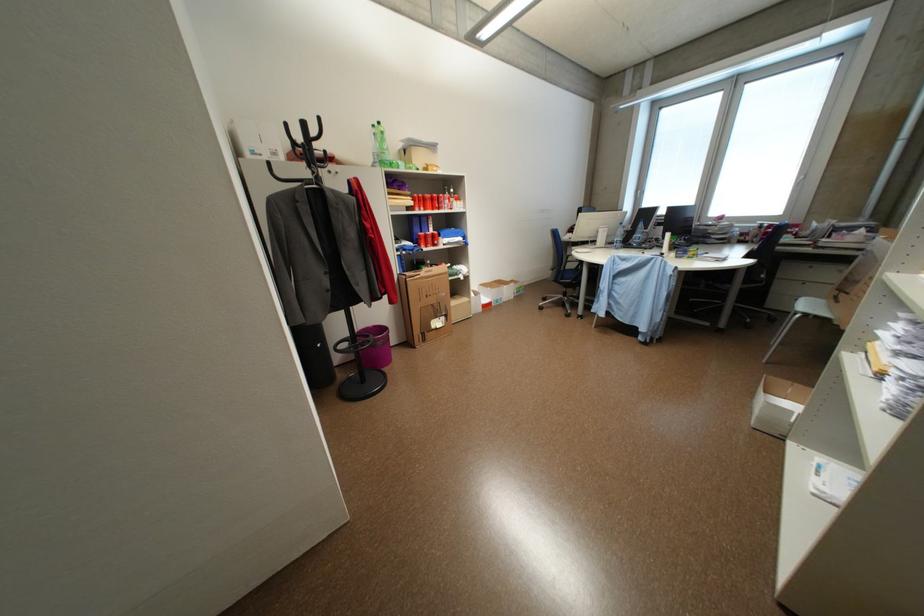
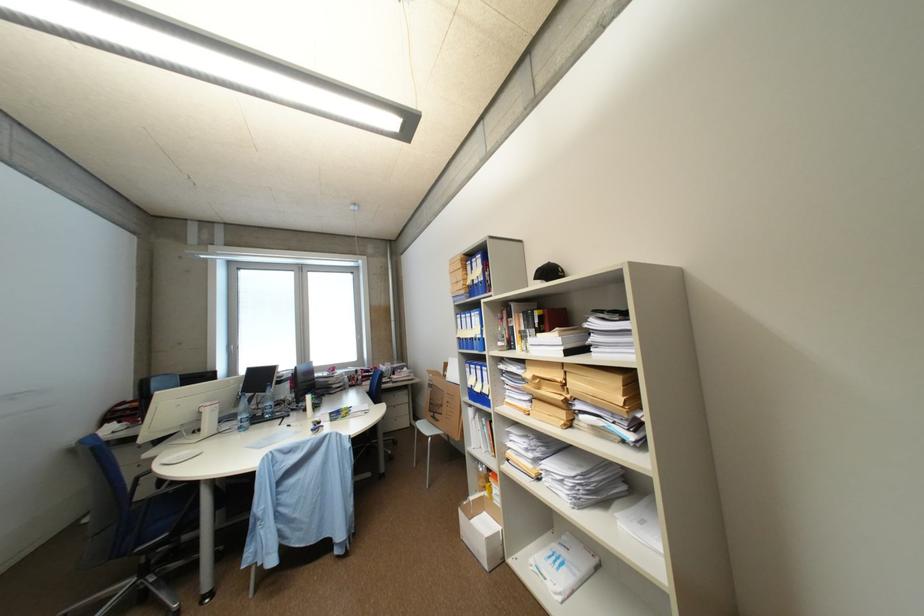
Question: The images are taken continuously from a first-person perspective. In which direction is your viewpoint rotating?

Choices:
 (A) Left
 (B) Right
 (C) Up
 (D) Down

Answer: (B)